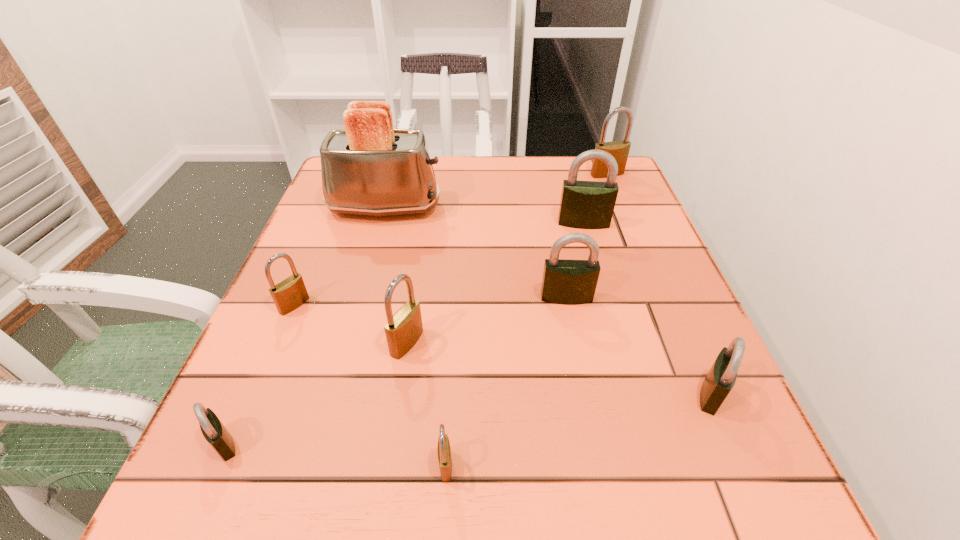
What are the coordinates of `free space that satisfies the following two spatial constraints: 1. on the back side of the leftmost brass padlock; 2. on the right side of the third nearest black padlock` in the screenshot? It's located at (298, 298).

Find the location of a particular element. This screenshot has width=960, height=540. free region that satisfies the following two spatial constraints: 1. on the front side of the fifth object from left to right; 2. on the left side of the fourth nearest object is located at coordinates [389, 465].

Find the location of a particular element. Image resolution: width=960 pixels, height=540 pixels. vacant space that satisfies the following two spatial constraints: 1. on the back side of the farthest black padlock; 2. on the left side of the third smallest black padlock is located at coordinates (552, 223).